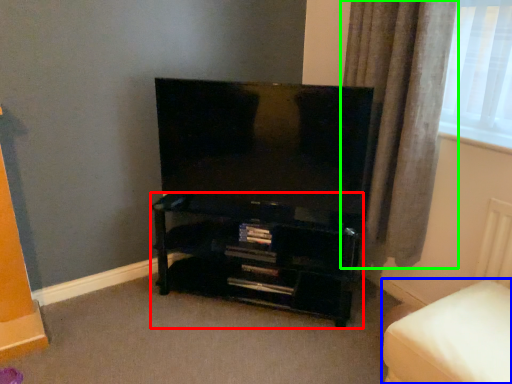
Question: Which is nearer to the shelf (highlighted by a red box)? furniture (highlighted by a blue box) or curtain (highlighted by a green box).

Choices:
 (A) furniture
 (B) curtain

Answer: (B)